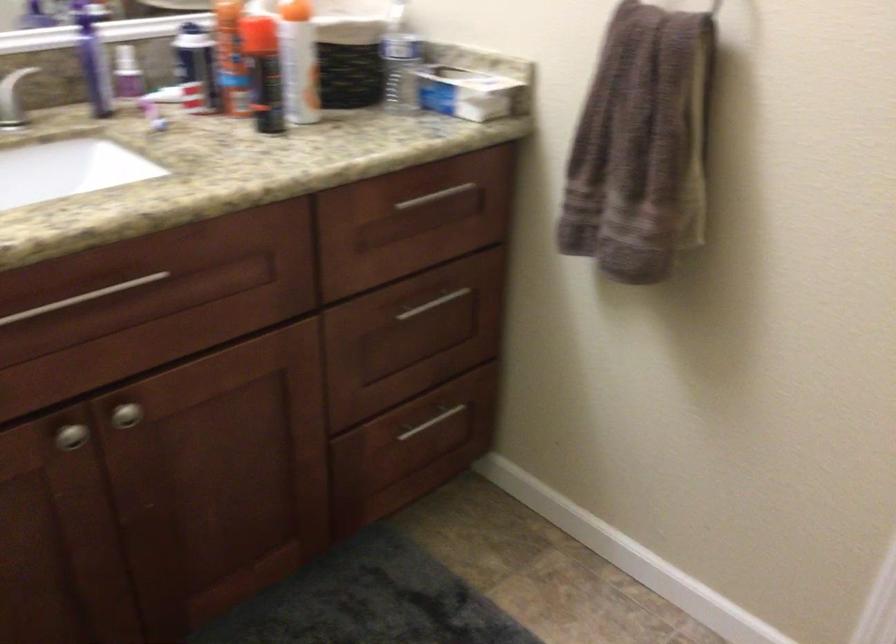
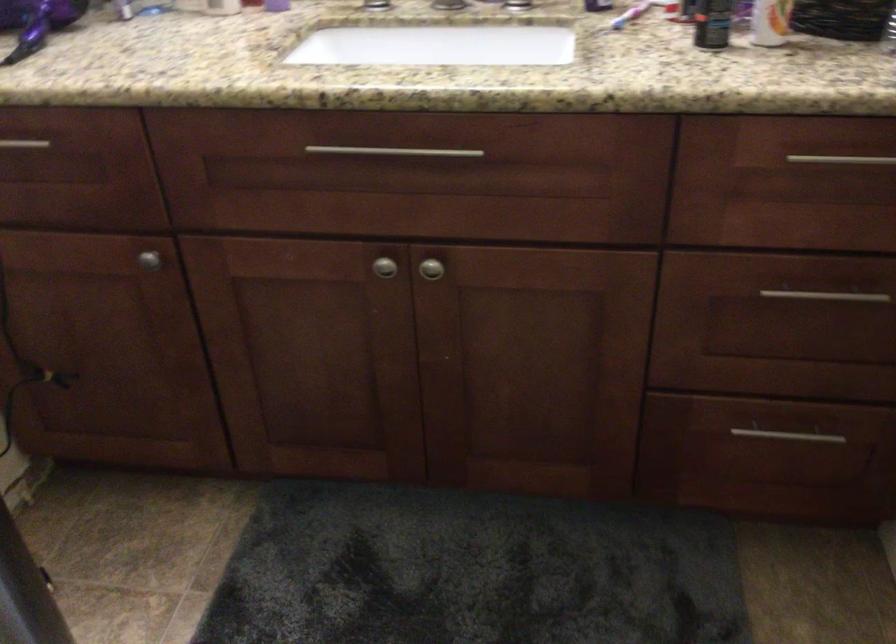
Question: How did the camera likely rotate?

Choices:
 (A) Left
 (B) Right
 (C) Up
 (D) Down

Answer: (A)